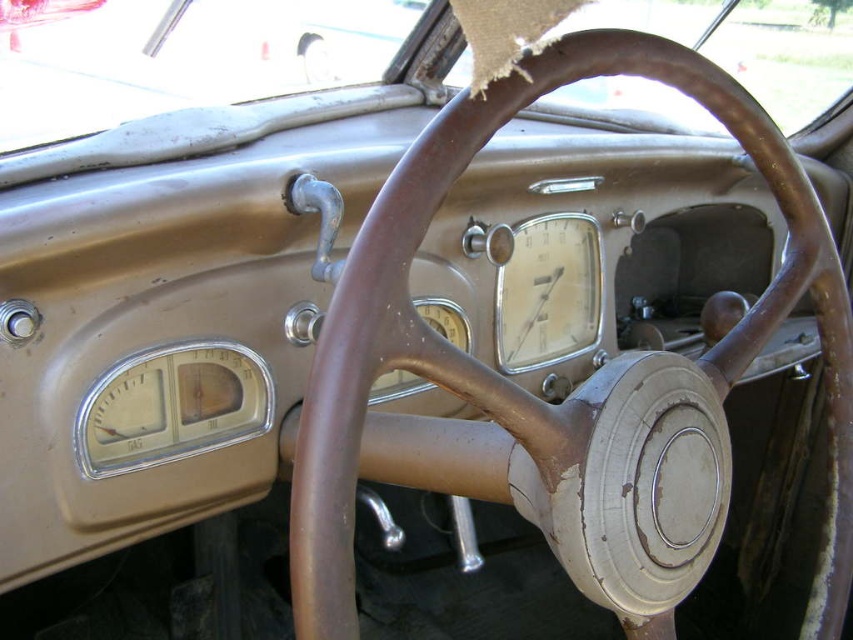
Who is taller, metallic silver speedometer at center or brown leather steering wheel at center?

Standing taller between the two is metallic silver speedometer at center.

Does point (514, 228) come behind point (331, 81)?

No, it is not.

Find the location of a particular element. This screenshot has height=640, width=853. metallic silver speedometer at center is located at coordinates (548, 291).